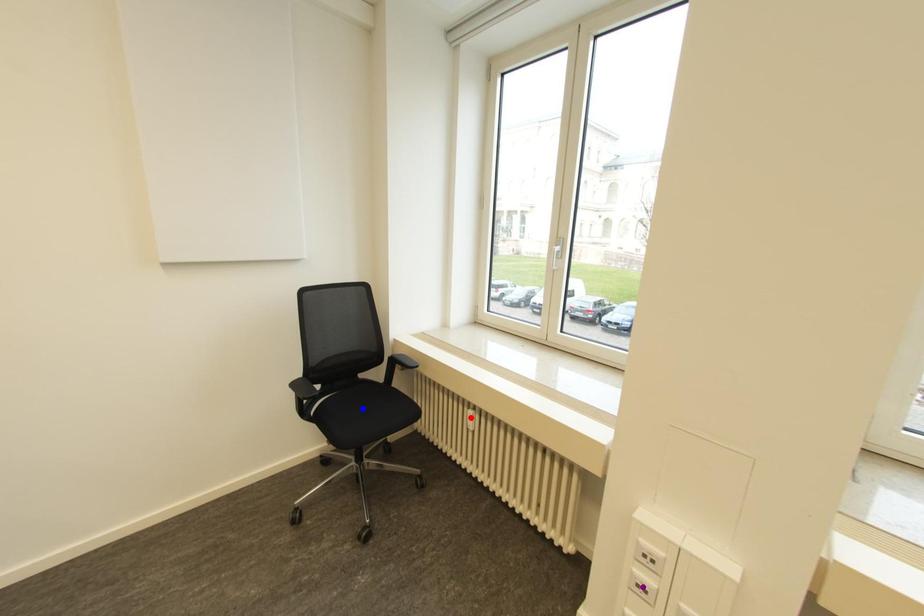
Order these from farthest to nearest:
A) purple point
B) blue point
C) red point

blue point < red point < purple point